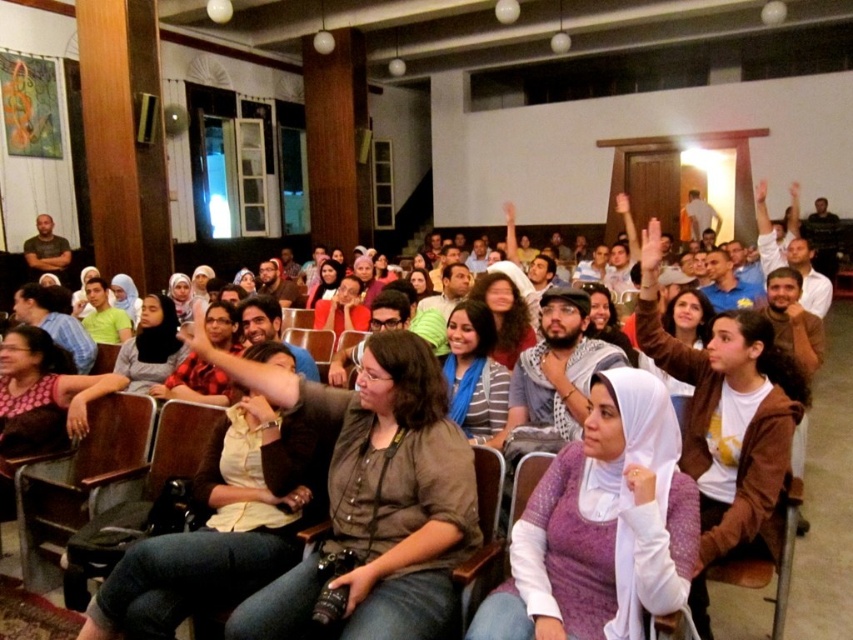
Question: Which point is closer to the camera?

Choices:
 (A) matte black shirt at center
 (B) striped shirt at center
 (C) brown fabric shirt at center
 (D) matte black hijab at center

Answer: (C)

Question: Can you confirm if brown fabric jacket at center is wider than matte black shirt at center?

Choices:
 (A) no
 (B) yes

Answer: (A)

Question: Does light brown leather jacket at center appear on the left side of light green shirt at center?

Choices:
 (A) no
 (B) yes

Answer: (A)

Question: Can you confirm if brown fabric jacket at center is wider than matte black shirt at left?

Choices:
 (A) yes
 (B) no

Answer: (A)

Question: Estimate the real-world distances between objects in this image. Which object is farther from the matte black shirt at center?

Choices:
 (A) purple knit sweater at center
 (B) brown fabric shirt at center

Answer: (A)

Question: Which point is farther to the camera?

Choices:
 (A) light brown leather jacket at center
 (B) striped shirt at center
 (C) light green shirt at center

Answer: (C)